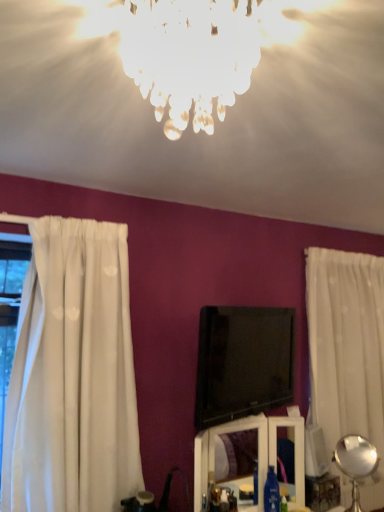
Question: Is white glossy vanity at lower center thinner than icy glass chandelier at upper center, which ranks as the second lamp in bottom-to-top order?

Choices:
 (A) yes
 (B) no

Answer: (A)

Question: From a real-world perspective, is white glossy vanity at lower center under icy glass chandelier at upper center, which ranks as the second lamp in bottom-to-top order?

Choices:
 (A) yes
 (B) no

Answer: (A)

Question: Is white glossy vanity at lower center not close to icy glass chandelier at upper center, which appears as the 1th lamp when viewed from the left?

Choices:
 (A) no
 (B) yes

Answer: (B)

Question: Is white glossy vanity at lower center oriented away from icy glass chandelier at upper center, the first lamp viewed from the front?

Choices:
 (A) yes
 (B) no

Answer: (B)

Question: Does white glossy vanity at lower center lie behind icy glass chandelier at upper center, the 2th lamp in the back-to-front sequence?

Choices:
 (A) no
 (B) yes

Answer: (B)

Question: Considering the positions of point (226, 25) and point (266, 307), is point (226, 25) closer or farther from the camera than point (266, 307)?

Choices:
 (A) closer
 (B) farther

Answer: (A)

Question: From their relative heights in the image, would you say icy glass chandelier at upper center, which ranks as the second lamp in bottom-to-top order, is taller or shorter than black glossy tv at center?

Choices:
 (A) short
 (B) tall

Answer: (A)

Question: From the image's perspective, relative to black glossy tv at center, is icy glass chandelier at upper center, the 2th lamp in the back-to-front sequence, above or below?

Choices:
 (A) below
 (B) above

Answer: (B)

Question: Would you say icy glass chandelier at upper center, which appears as the 1th lamp when viewed from the left, is to the left or to the right of black glossy tv at center in the picture?

Choices:
 (A) left
 (B) right

Answer: (A)

Question: Would you say black glossy tv at center is to the left or to the right of white glossy vanity at lower center in the picture?

Choices:
 (A) right
 (B) left

Answer: (A)

Question: Considering the positions of point (292, 365) and point (302, 477), is point (292, 365) closer or farther from the camera than point (302, 477)?

Choices:
 (A) closer
 (B) farther

Answer: (B)

Question: Looking at their shapes, would you say black glossy tv at center is wider or thinner than white glossy vanity at lower center?

Choices:
 (A) wide
 (B) thin

Answer: (B)

Question: Choose the correct answer: Is black glossy tv at center inside white glossy vanity at lower center or outside it?

Choices:
 (A) outside
 (B) inside

Answer: (A)

Question: Would you say white sheer curtain at right is to the left or to the right of icy glass chandelier at upper center, which appears as the 1th lamp when viewed from the left, in the picture?

Choices:
 (A) left
 (B) right

Answer: (B)

Question: In the image, is white sheer curtain at right positioned in front of or behind icy glass chandelier at upper center, which appears as the 1th lamp when viewed from the top?

Choices:
 (A) behind
 (B) front

Answer: (A)